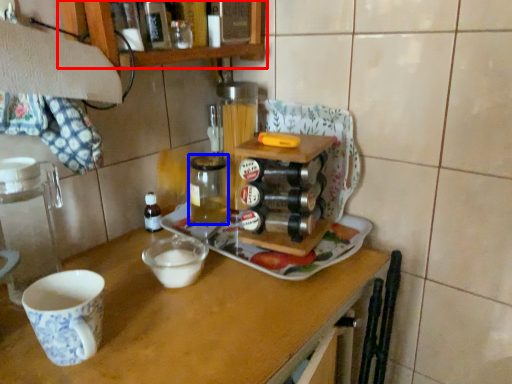
Question: Which object is further to the camera taking this photo, cabinetry (highlighted by a red box) or beverage (highlighted by a blue box)?

Choices:
 (A) cabinetry
 (B) beverage

Answer: (B)